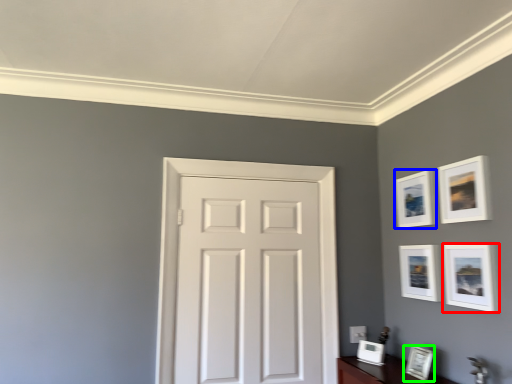
Question: Which is nearer to the picture frame (highlighted by a red box)? picture frame (highlighted by a blue box) or picture frame (highlighted by a green box).

Choices:
 (A) picture frame
 (B) picture frame

Answer: (A)